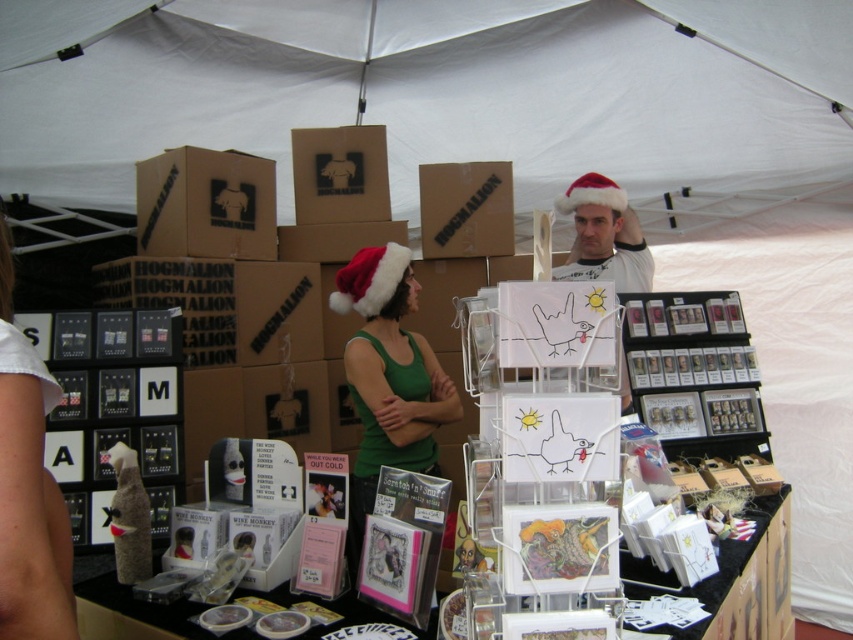
Can you confirm if white fabric canopy at upper center is positioned to the left of brown cardboard box at center?

Correct, you'll find white fabric canopy at upper center to the left of brown cardboard box at center.

Is white fabric canopy at upper center above brown cardboard box at center?

Correct, white fabric canopy at upper center is located above brown cardboard box at center.

Is point (403, 147) positioned after point (428, 236)?

Yes, point (403, 147) is behind point (428, 236).

At what (x,y) coordinates should I click in order to perform the action: click on white fabric canopy at upper center. Please return your answer as a coordinate pair (x, y). This screenshot has height=640, width=853. Looking at the image, I should click on (434, 90).

Can you confirm if brown cardboard box at center is shorter than fuzzy red santa hat at center?

Incorrect, brown cardboard box at center's height does not fall short of fuzzy red santa hat at center's.

Is brown cardboard box at center above fuzzy red santa hat at center?

Indeed, brown cardboard box at center is positioned over fuzzy red santa hat at center.

The width and height of the screenshot is (853, 640). Describe the element at coordinates (465, 209) in the screenshot. I see `brown cardboard box at center` at that location.

Locate an element on the screen. brown cardboard box at center is located at coordinates (465, 209).

Is white fabric canopy at upper center taller than clear plastic cards at center?

Yes.

In the scene shown: Which of these two, white fabric canopy at upper center or clear plastic cards at center, stands taller?

With more height is white fabric canopy at upper center.

Identify the location of white fabric canopy at upper center. This screenshot has height=640, width=853. (434, 90).